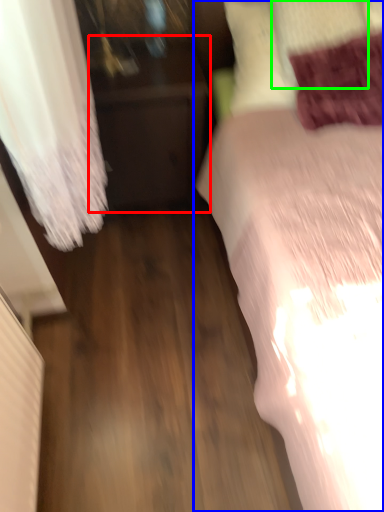
Question: Which is nearer to the furniture (highlighted by a red box)? bed (highlighted by a blue box) or pillow (highlighted by a green box).

Choices:
 (A) bed
 (B) pillow

Answer: (A)